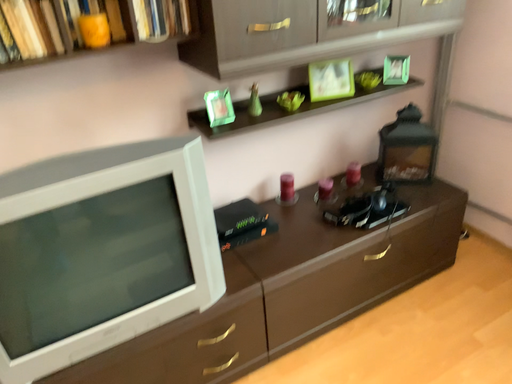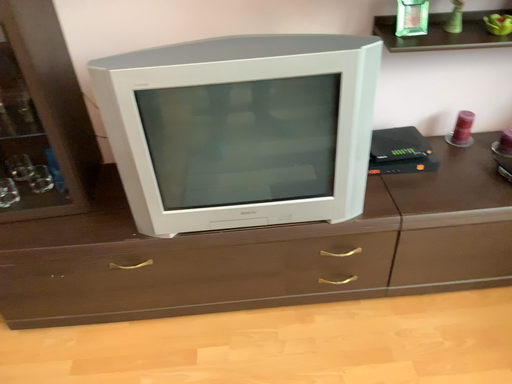
Question: How did the camera likely rotate when shooting the video?

Choices:
 (A) rotated right
 (B) rotated left

Answer: (B)